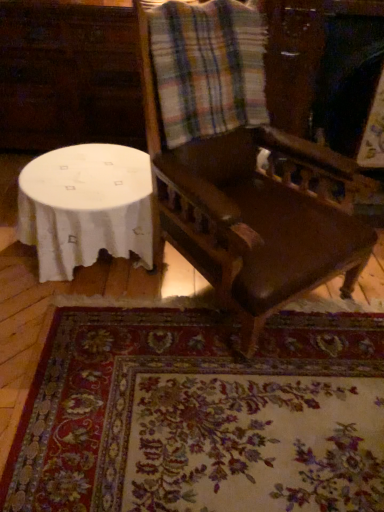
The width and height of the screenshot is (384, 512). Describe the element at coordinates (208, 68) in the screenshot. I see `plaid fabric at upper center` at that location.

Measure the distance between dark brown wood chair at center and camera.

A distance of 4.24 feet exists between dark brown wood chair at center and camera.

What do you see at coordinates (249, 213) in the screenshot? I see `dark brown wood chair at center` at bounding box center [249, 213].

The width and height of the screenshot is (384, 512). What do you see at coordinates (201, 415) in the screenshot?
I see `floral carpet at lower center` at bounding box center [201, 415].

Where is `plaid fabric at upper center`? plaid fabric at upper center is located at coordinates (208, 68).

Considering the sizes of objects white cloth-covered table at lower left and dark brown wood chair at center in the image provided, who is thinner, white cloth-covered table at lower left or dark brown wood chair at center?

white cloth-covered table at lower left.

Is white cloth-covered table at lower left at the left side of dark brown wood chair at center?

Yes, white cloth-covered table at lower left is to the left of dark brown wood chair at center.

Is white cloth-covered table at lower left far from dark brown wood chair at center?

white cloth-covered table at lower left is actually quite close to dark brown wood chair at center.

From a real-world perspective, is white cloth-covered table at lower left under dark brown wood chair at center?

Yes, from a real-world perspective, white cloth-covered table at lower left is beneath dark brown wood chair at center.

From the picture: From the image's perspective, is floral carpet at lower center over white cloth-covered table at lower left?

Incorrect, from the image's perspective, floral carpet at lower center is lower than white cloth-covered table at lower left.

Is floral carpet at lower center touching white cloth-covered table at lower left?

floral carpet at lower center and white cloth-covered table at lower left are not in contact.

Is floral carpet at lower center oriented towards white cloth-covered table at lower left?

No, floral carpet at lower center does not turn towards white cloth-covered table at lower left.

Can you confirm if plaid fabric at upper center is smaller than white cloth-covered table at lower left?

Incorrect, plaid fabric at upper center is not smaller in size than white cloth-covered table at lower left.

From the image's perspective, would you say plaid fabric at upper center is positioned over white cloth-covered table at lower left?

Yes, from the image's perspective, plaid fabric at upper center is over white cloth-covered table at lower left.

Are plaid fabric at upper center and white cloth-covered table at lower left beside each other?

No.

Does plaid fabric at upper center have a greater width compared to white cloth-covered table at lower left?

In fact, plaid fabric at upper center might be narrower than white cloth-covered table at lower left.

Does point (345, 243) lie behind point (159, 41)?

Yes.

Locate an element on the screen. The width and height of the screenshot is (384, 512). flannel behind the dark brown wood chair at center is located at coordinates (208, 68).

From the image's perspective, is dark brown wood chair at center above or below plaid fabric at upper center?

Based on their image positions, dark brown wood chair at center is located beneath plaid fabric at upper center.

Does dark brown wood chair at center have a larger size compared to floral carpet at lower center?

Yes.

Is point (249, 158) behind point (346, 387)?

Yes, point (249, 158) is farther from viewer.

From the image's perspective, is dark brown wood chair at center under floral carpet at lower center?

No.

Which is behind, white cloth-covered table at lower left or floral carpet at lower center?

white cloth-covered table at lower left is further from the camera.

Is the surface of white cloth-covered table at lower left in direct contact with floral carpet at lower center?

white cloth-covered table at lower left and floral carpet at lower center are not in contact.

From the image's perspective, which object appears higher, white cloth-covered table at lower left or floral carpet at lower center?

white cloth-covered table at lower left, from the image's perspective.

Find the location of a particular element. The width and height of the screenshot is (384, 512). mat that appears below the white cloth-covered table at lower left (from the image's perspective) is located at coordinates (201, 415).

Is floral carpet at lower center placed right next to plaid fabric at upper center?

floral carpet at lower center is not next to plaid fabric at upper center, and they're not touching.

From the image's perspective, is floral carpet at lower center under plaid fabric at upper center?

Yes, from the image's perspective, floral carpet at lower center is below plaid fabric at upper center.

Based on the photo, how much distance is there between floral carpet at lower center and plaid fabric at upper center?

They are 39.26 inches apart.

Who is shorter, floral carpet at lower center or plaid fabric at upper center?

floral carpet at lower center is shorter.

In the image, there is a dark brown wood chair at center. Where is `table below it (from the image's perspective)`? The height and width of the screenshot is (512, 384). table below it (from the image's perspective) is located at coordinates (86, 207).

Find the location of `mat beneath the white cloth-covered table at lower left (from a real-world perspective)`. mat beneath the white cloth-covered table at lower left (from a real-world perspective) is located at coordinates (201, 415).

When comparing their distances from white cloth-covered table at lower left, does plaid fabric at upper center or dark brown wood chair at center seem further?

plaid fabric at upper center.

Looking at the image, which one is located closer to dark brown wood chair at center, plaid fabric at upper center or white cloth-covered table at lower left?

plaid fabric at upper center is closer to dark brown wood chair at center.

Looking at the image, which one is located closer to dark brown wood chair at center, floral carpet at lower center or plaid fabric at upper center?

The object closer to dark brown wood chair at center is plaid fabric at upper center.

Consider the image. Based on their spatial positions, is white cloth-covered table at lower left or plaid fabric at upper center closer to floral carpet at lower center?

white cloth-covered table at lower left.

Based on their spatial positions, is floral carpet at lower center or white cloth-covered table at lower left further from dark brown wood chair at center?

floral carpet at lower center lies further to dark brown wood chair at center than the other object.

Looking at the image, which one is located closer to white cloth-covered table at lower left, plaid fabric at upper center or floral carpet at lower center?

Based on the image, plaid fabric at upper center appears to be nearer to white cloth-covered table at lower left.

Estimate the real-world distances between objects in this image. Which object is closer to floral carpet at lower center, plaid fabric at upper center or dark brown wood chair at center?

Among the two, dark brown wood chair at center is located nearer to floral carpet at lower center.

Estimate the real-world distances between objects in this image. Which object is further from plaid fabric at upper center, floral carpet at lower center or white cloth-covered table at lower left?

Based on the image, floral carpet at lower center appears to be further to plaid fabric at upper center.

Where is `mat between white cloth-covered table at lower left and dark brown wood chair at center`? mat between white cloth-covered table at lower left and dark brown wood chair at center is located at coordinates (201, 415).

This screenshot has height=512, width=384. Find the location of `chair between plaid fabric at upper center and floral carpet at lower center vertically`. chair between plaid fabric at upper center and floral carpet at lower center vertically is located at coordinates (249, 213).

This screenshot has height=512, width=384. I want to click on flannel located between white cloth-covered table at lower left and dark brown wood chair at center in the left-right direction, so click(x=208, y=68).

Identify the location of table that lies between plaid fabric at upper center and floral carpet at lower center from top to bottom. The height and width of the screenshot is (512, 384). click(86, 207).